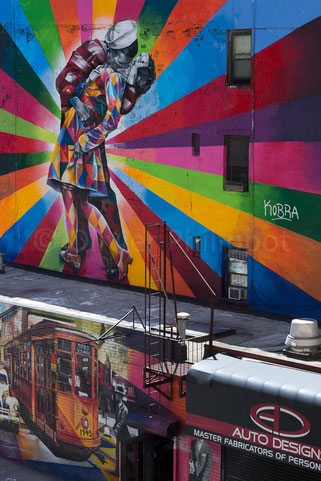
At what (x,y) coordinates should I click in order to perform the action: click on door. Please return your answer as a coordinate pair (x, y). The width and height of the screenshot is (321, 481). Looking at the image, I should click on (155, 460).